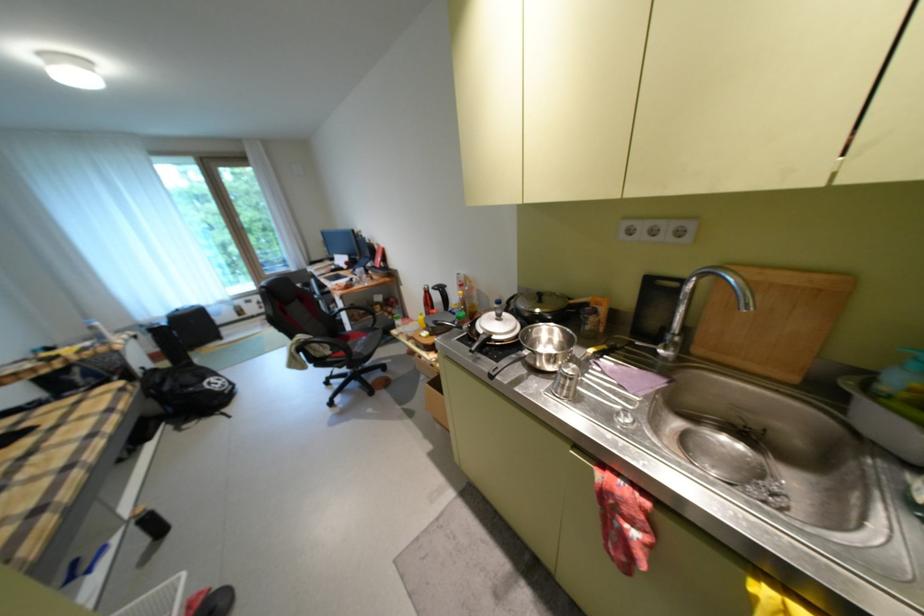
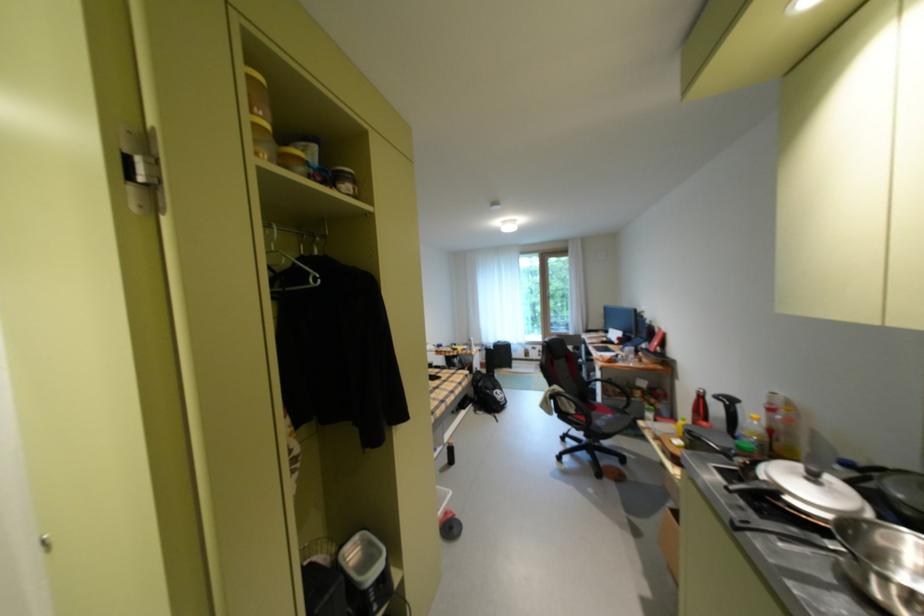
Locate, in the second image, the point that corresponds to point 550,365 in the first image.

(888, 594)